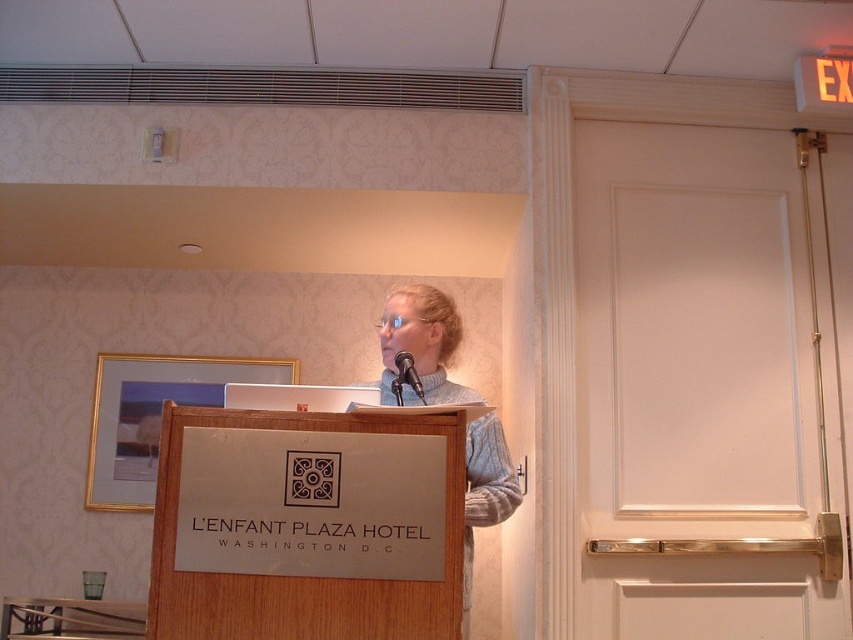
You are standing in the conference room and see two points marked on the wall. The first point is at coordinates point [485,422] and the second point is at point [401,365]. Which point is further away from you?

Point [485,422] is behind point [401,365], so it is further away from you.

You are an attendee at the event and want to take a photo of the speaker. Since you can only focus on one object at a time, which one should you choose to ensure the speaker is in focus? The gray wool sweater at center or the black metallic microphone at center?

The gray wool sweater at center is closer to the viewer than the black metallic microphone at center. To ensure the speaker is in focus, you should focus on the gray wool sweater at center since it is closer.